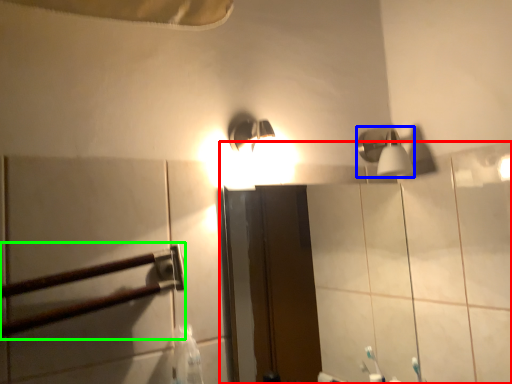
Question: Considering the real-world distances, which object is farthest from mirror (highlighted by a red box)? shower (highlighted by a blue box) or rail (highlighted by a green box)?

Choices:
 (A) shower
 (B) rail

Answer: (B)